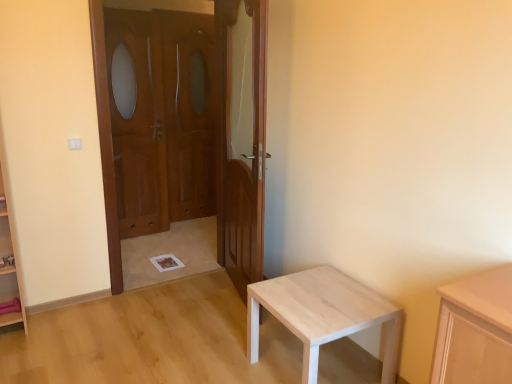
At what (x,y) coordinates should I click in order to perform the action: click on vacant area on top of light wood table at lower right (from a real-world perspective). Please return your answer as a coordinate pair (x, y). The height and width of the screenshot is (384, 512). Looking at the image, I should click on (324, 296).